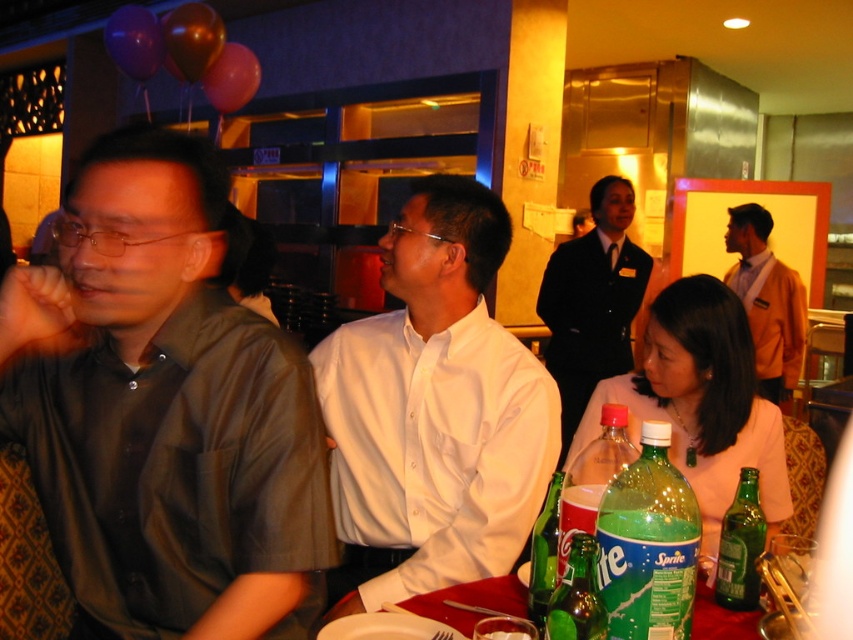
You are a photographer standing at the center of the room. You want to take a picture that includes both the pink fabric at lower right and the shiny dark red balloon at upper left. Given that your camera has a maximum angle of view of 90 degrees, can you capture both objects in a single frame without moving?

The distance between the pink fabric at lower right and the shiny dark red balloon at upper left is 10.05 feet. Since the camera has a maximum angle of view of 90 degrees, you can capture both objects in a single frame without moving.

You are a photographer at the event and want to capture a photo of the shiny dark red balloon at upper left without the pink fabric at lower right blocking it. What should you do?

Move the camera position to the left or right so that the pink fabric at lower right is no longer in front of the shiny dark red balloon at upper left.

You are standing at the entrance of the restaurant and want to locate the dark green shirt at left. Based on the coordinates provided, where should you look relative to the center of the image?

The dark green shirt at left is located at coordinates 0.641 on the x axis and 0.193 on the y axis, which is to the right and slightly below the center of the image.